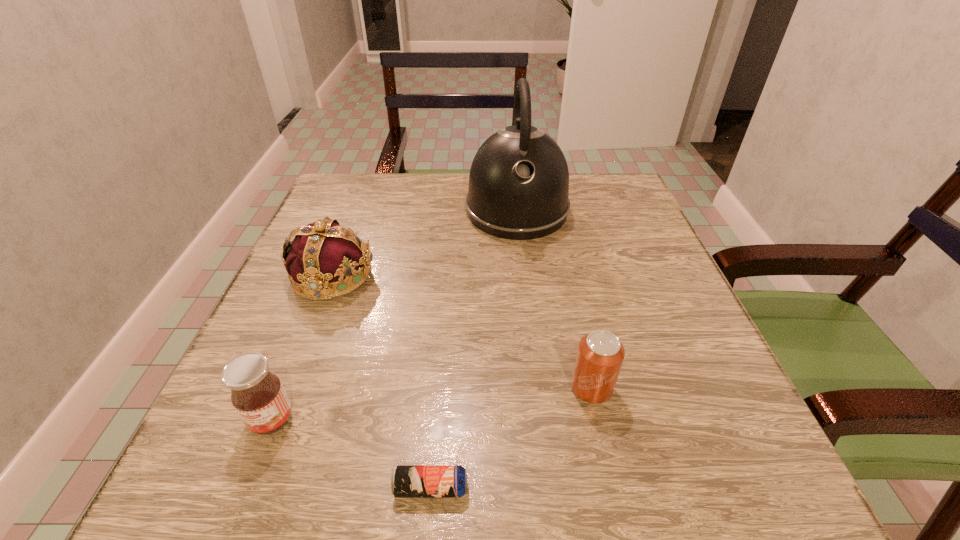
Identify the location of vacant space at the far right corner of the desktop. The image size is (960, 540). (596, 205).

The height and width of the screenshot is (540, 960). I want to click on vacant position at the near right corner of the desktop, so click(776, 491).

Where is `vacant area that lies between the jam and the kettle`? vacant area that lies between the jam and the kettle is located at coordinates (395, 315).

In order to click on free spot between the jam and the farthest object in this screenshot , I will do `click(395, 315)`.

Where is `free point between the tallest object and the shortest object`? This screenshot has width=960, height=540. free point between the tallest object and the shortest object is located at coordinates (474, 349).

I want to click on free point between the fourth nearest object and the nearest object, so click(x=382, y=382).

At what (x,y) coordinates should I click in order to perform the action: click on vacant space that's between the can and the kettle. Please return your answer as a coordinate pair (x, y). Looking at the image, I should click on (554, 299).

Where is `vacant point located between the tallest object and the can`? vacant point located between the tallest object and the can is located at coordinates (554, 299).

Where is `free space between the nearest object and the second farthest object`? The image size is (960, 540). free space between the nearest object and the second farthest object is located at coordinates (382, 382).

Where is `vacant region between the jam and the farthest object`? vacant region between the jam and the farthest object is located at coordinates (395, 315).